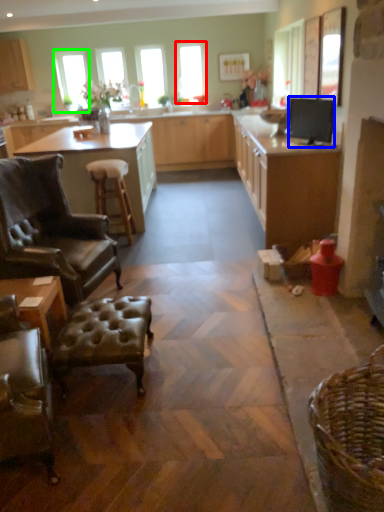
Question: Estimate the real-world distances between objects in this image. Which object is farther from window (highlighted by a red box), appliance (highlighted by a blue box) or window (highlighted by a green box)?

Choices:
 (A) appliance
 (B) window

Answer: (A)